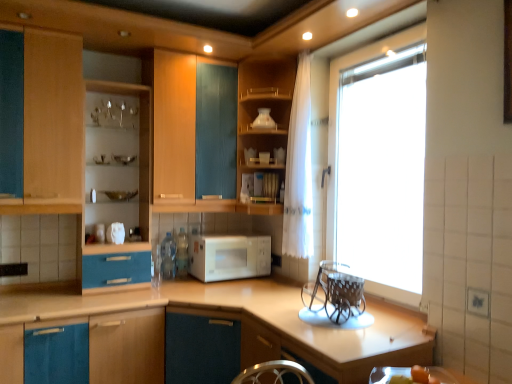
I want to click on vacant area on top of transparent glass window at upper right (from a real-world perspective), so click(368, 40).